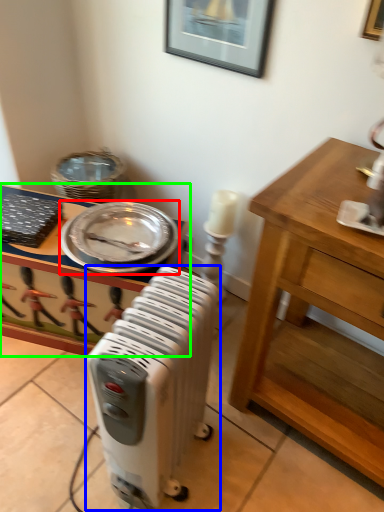
Question: Considering the real-world distances, which object is farthest from platter (highlighted by a red box)? home appliance (highlighted by a blue box) or desk (highlighted by a green box)?

Choices:
 (A) home appliance
 (B) desk

Answer: (A)